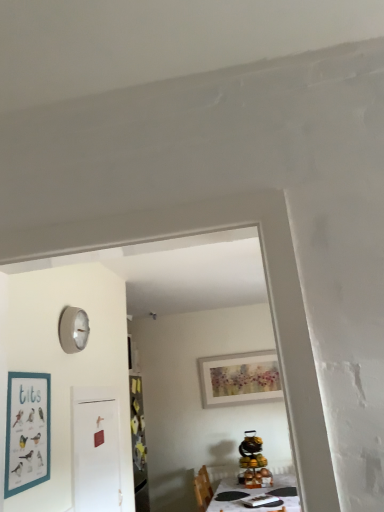
Question: From a real-world perspective, is white matte door at center over white glossy table at lower center?

Choices:
 (A) no
 (B) yes

Answer: (B)

Question: Is white matte door at center at the right side of white glossy table at lower center?

Choices:
 (A) no
 (B) yes

Answer: (A)

Question: Is white matte door at center not close to white glossy table at lower center?

Choices:
 (A) no
 (B) yes

Answer: (B)

Question: Is the depth of white matte door at center greater than that of white glossy table at lower center?

Choices:
 (A) no
 (B) yes

Answer: (A)

Question: Considering the relative sizes of white matte door at center and white glossy table at lower center in the image provided, is white matte door at center taller than white glossy table at lower center?

Choices:
 (A) yes
 (B) no

Answer: (A)

Question: From a real-world perspective, is white matte door at center positioned under white glossy table at lower center based on gravity?

Choices:
 (A) yes
 (B) no

Answer: (B)

Question: Is teal matte picture frame at left, the first picture frame from the front, thinner than white glossy table at lower center?

Choices:
 (A) no
 (B) yes

Answer: (B)

Question: Is teal matte picture frame at left, the 1th picture frame when ordered from top to bottom, shorter than white glossy table at lower center?

Choices:
 (A) no
 (B) yes

Answer: (A)

Question: Is teal matte picture frame at left, the first picture frame from the front, placed right next to white glossy table at lower center?

Choices:
 (A) no
 (B) yes

Answer: (A)

Question: Is teal matte picture frame at left, the 1th picture frame when ordered from top to bottom, wider than white glossy table at lower center?

Choices:
 (A) no
 (B) yes

Answer: (A)

Question: Would you say teal matte picture frame at left, the 1th picture frame in the left-to-right sequence, is outside white glossy table at lower center?

Choices:
 (A) no
 (B) yes

Answer: (B)

Question: Could you tell me if teal matte picture frame at left, the 2th picture frame viewed from the back, is turned towards white glossy table at lower center?

Choices:
 (A) no
 (B) yes

Answer: (A)

Question: Can you see watercolor paper picture frame at upper center, the 1th picture frame positioned from the bottom, touching white glossy table at lower center?

Choices:
 (A) yes
 (B) no

Answer: (B)